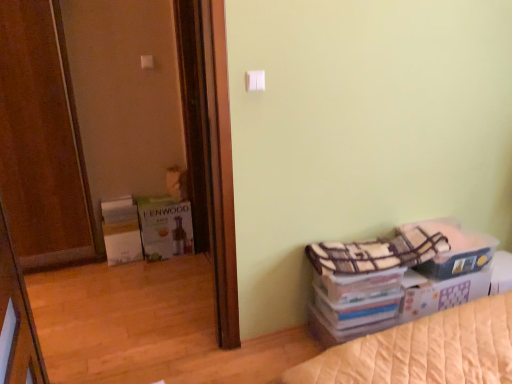
Question: Is white plastic light switch at upper center, which is counted as the first light switch, starting from the bottom, in front of or behind plaid fabric storage box at lower right in the image?

Choices:
 (A) behind
 (B) front

Answer: (B)

Question: From their relative heights in the image, would you say white plastic light switch at upper center, which is counted as the first light switch, starting from the bottom, is taller or shorter than plaid fabric storage box at lower right?

Choices:
 (A) short
 (B) tall

Answer: (A)

Question: Which is nearer to the wooden door at left?

Choices:
 (A) white plastic light switch at upper center, which ranks as the 2th light switch in right-to-left order
 (B) brown wooden screen door at left
 (C) white plastic light switch at upper center, positioned as the second light switch in top-to-bottom order
 (D) plaid fabric storage box at lower right

Answer: (A)

Question: Considering the real-world distances, which object is farthest from the wooden door at left?

Choices:
 (A) white plastic light switch at upper center, which ranks as the 2th light switch in bottom-to-top order
 (B) brown wooden screen door at left
 (C) white plastic light switch at upper center, the first light switch viewed from the front
 (D) plaid fabric storage box at lower right

Answer: (D)